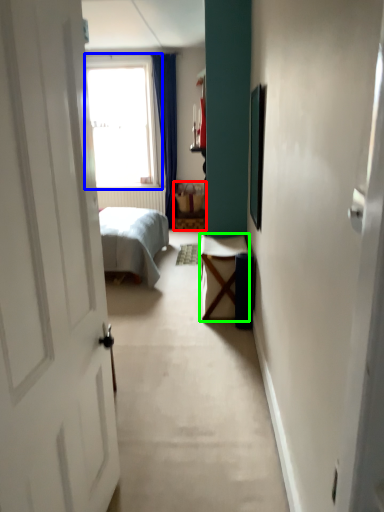
Question: Which is farther away from furniture (highlighted by a red box)? window (highlighted by a blue box) or table (highlighted by a green box)?

Choices:
 (A) window
 (B) table

Answer: (B)